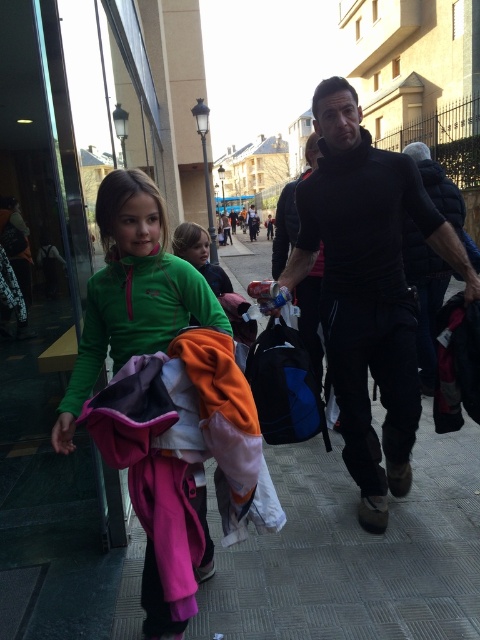
Question: Among these points, which one is farthest from the camera?

Choices:
 (A) click(x=158, y=234)
 (B) click(x=192, y=253)

Answer: (B)

Question: Can you confirm if gray concrete pavement at center is positioned to the left of green fleece jacket at left?

Choices:
 (A) yes
 (B) no

Answer: (B)

Question: Is gray concrete pavement at center to the right of black quilted vest at center from the viewer's perspective?

Choices:
 (A) yes
 (B) no

Answer: (B)

Question: Among these points, which one is nearest to the camera?

Choices:
 (A) (315, 192)
 (B) (194, 497)

Answer: (B)

Question: Which of the following is the closest to the observer?

Choices:
 (A) black quilted vest at center
 (B) green fleece jacket at center

Answer: (B)

Question: Does gray concrete pavement at center come behind black matte turtleneck at center?

Choices:
 (A) yes
 (B) no

Answer: (B)